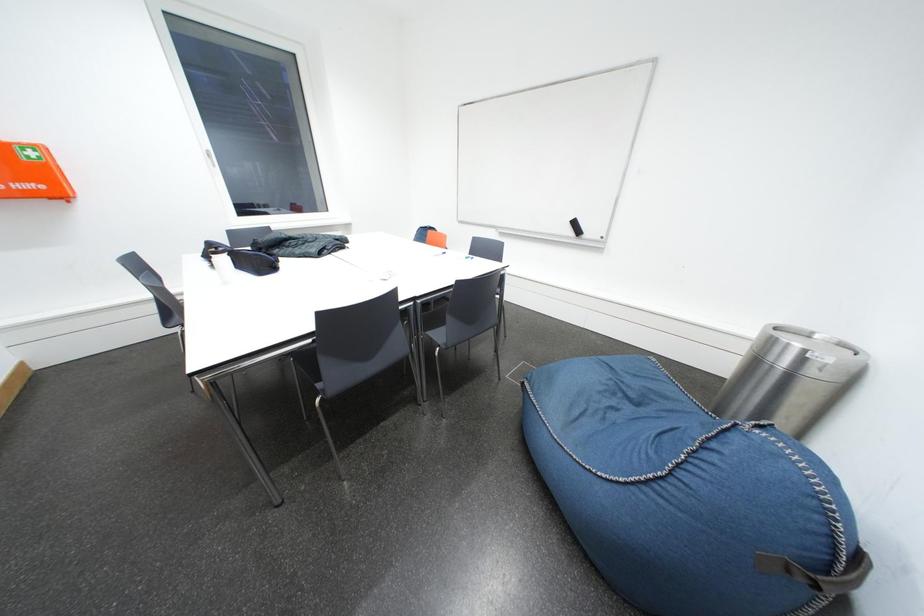
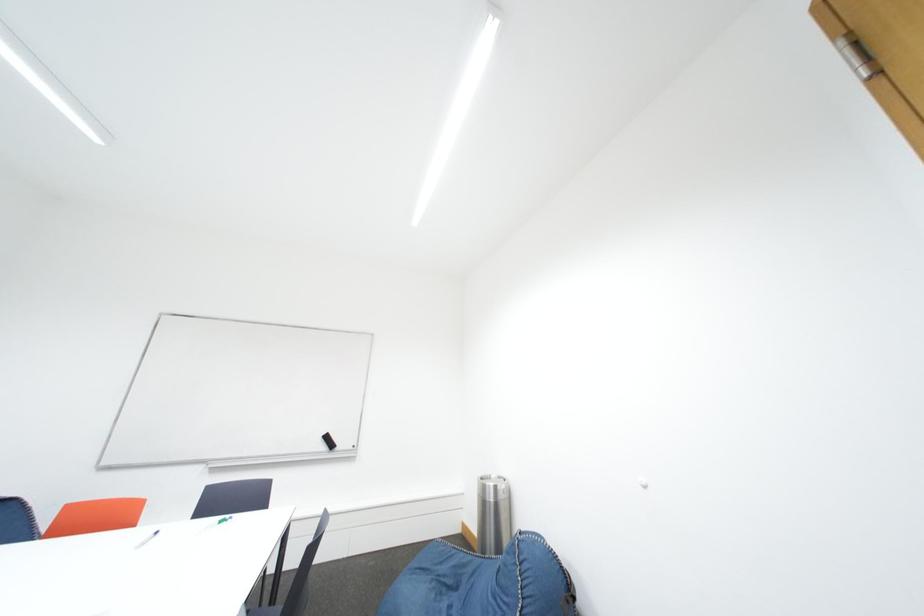
Consider the image. How did the camera likely rotate?

The camera's rotation is toward right-up.